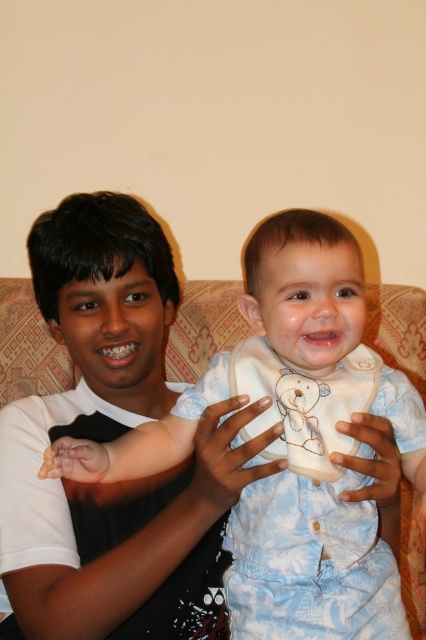
You are a parent looking for a white soft bib at center in the image. Where exactly is it located?

The white soft bib at center is located at point (308, 563).

You are an artist trying to draw the scene. You want to place the dark skin hand at center accurately. According to the coordinates given, where should you position it on your canvas?

The dark skin hand at center should be positioned at coordinates point (227, 454) on the canvas.